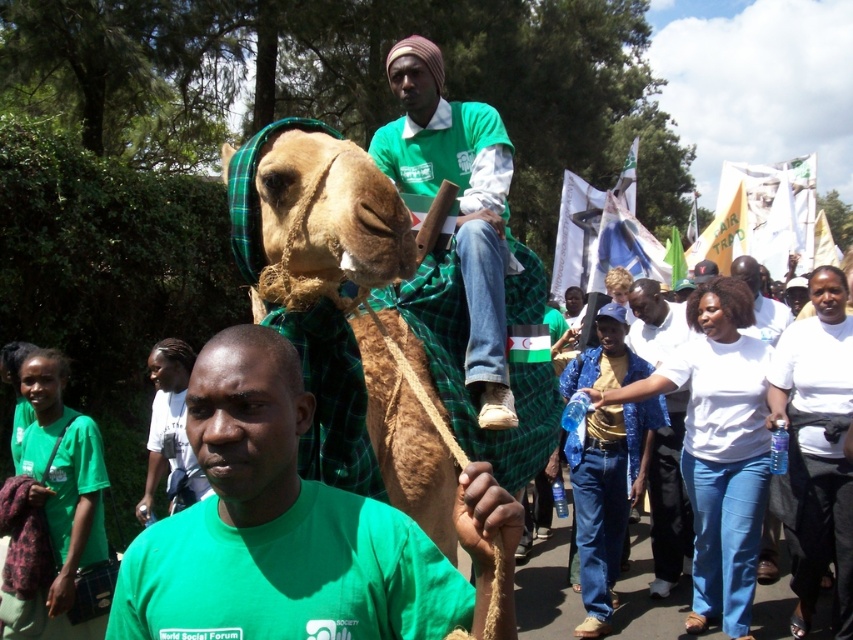
Can you confirm if brown woolen camel at center is shorter than white cotton shirt at center?

Correct, brown woolen camel at center is not as tall as white cotton shirt at center.

Does point (229, 205) lie behind point (654, 560)?

No, it is in front of (654, 560).

Where is `brown woolen camel at center`? brown woolen camel at center is located at coordinates (347, 310).

Is point (397, 602) behind point (433, 124)?

No, (397, 602) is in front of (433, 124).

Does green matte shirt at center lie in front of green fabric cloth at center?

That is True.

Is point (206, 548) positioned behind point (462, 275)?

No.

Where is `green matte shirt at center`? green matte shirt at center is located at coordinates (299, 531).

Which is more to the left, green matte shirt at center or brown woolen camel at center?

green matte shirt at center

Does green matte shirt at center have a greater height compared to brown woolen camel at center?

Incorrect, green matte shirt at center's height is not larger of brown woolen camel at center's.

Between point (323, 545) and point (410, 432), which one is positioned behind?

Positioned behind is point (410, 432).

What are the coordinates of `green matte shirt at center` in the screenshot? It's located at (299, 531).